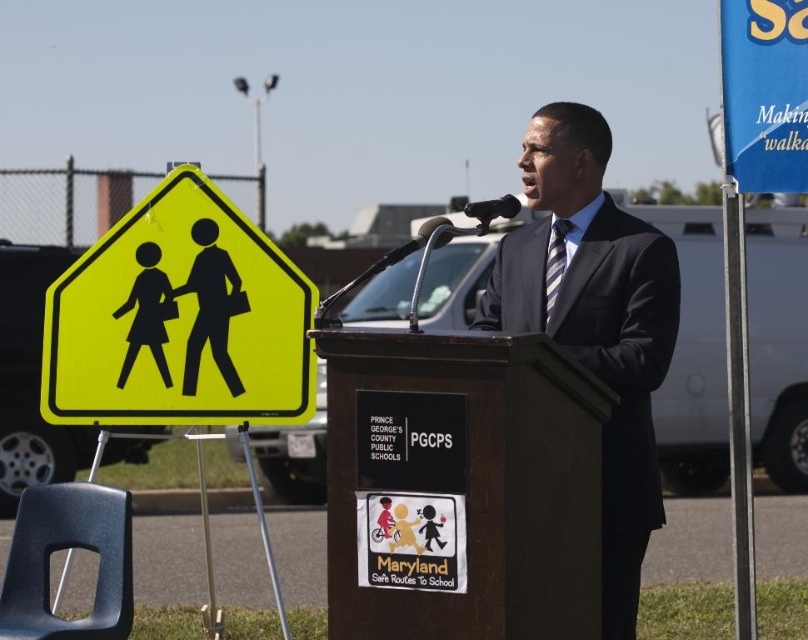
Does yellow plastic sign at left have a larger size compared to dark blue suit at center?

No.

Who is shorter, yellow plastic sign at left or dark blue suit at center?

yellow plastic sign at left is shorter.

Who is more forward, (316, 296) or (642, 316)?

Point (642, 316) is in front.

The height and width of the screenshot is (640, 808). Identify the location of yellow plastic sign at left. (179, 320).